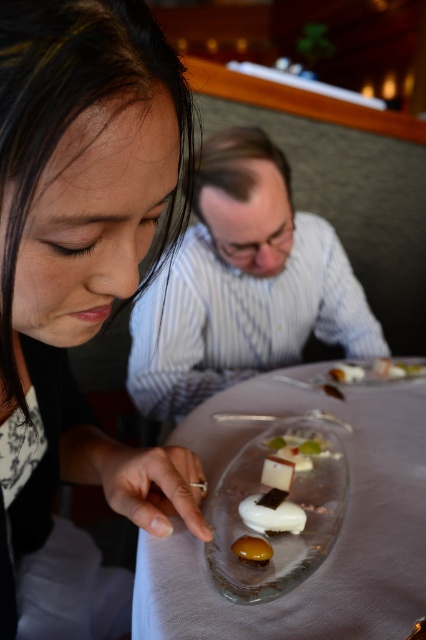
Question: Which object is the closest to the white glossy dessert at center?

Choices:
 (A) matte black hair at upper left
 (B) white striped shirt at upper center
 (C) yellow glossy sauce at center
 (D) translucent glass platter at center

Answer: (D)

Question: Does yellow glossy sauce at center have a greater width compared to white glossy dessert at center?

Choices:
 (A) no
 (B) yes

Answer: (A)

Question: Does clear glass plate at center have a larger size compared to yellow glossy sauce at center?

Choices:
 (A) yes
 (B) no

Answer: (A)

Question: Estimate the real-world distances between objects in this image. Which object is closer to the yellow glossy sauce at center?

Choices:
 (A) transparent glass plate at center
 (B) white striped shirt at upper center
 (C) clear glass plate at center
 (D) translucent glass platter at center

Answer: (A)

Question: Based on their relative distances, which object is nearer to the clear glass plate at center?

Choices:
 (A) white glossy dessert at center
 (B) transparent glass plate at center
 (C) white striped shirt at upper center

Answer: (B)

Question: Can you confirm if clear glass plate at center is bigger than white glossy dessert at center?

Choices:
 (A) yes
 (B) no

Answer: (A)